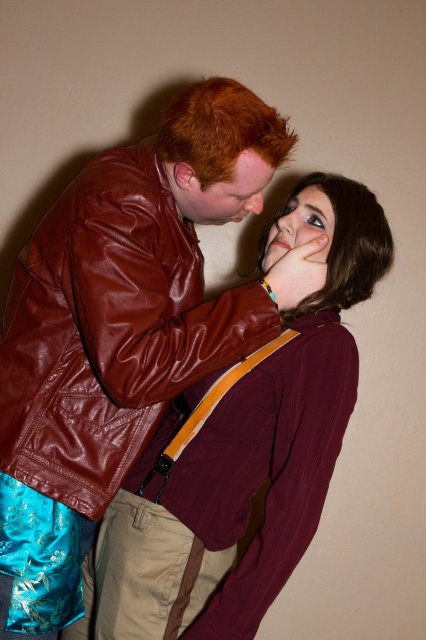
Does point (245, 355) lie in front of point (166, 134)?

No, it is not.

Does shiny brown leather jacket at upper left appear on the left side of smooth brown hair at upper center?

Yes, shiny brown leather jacket at upper left is to the left of smooth brown hair at upper center.

The width and height of the screenshot is (426, 640). What do you see at coordinates (109, 330) in the screenshot?
I see `shiny brown leather jacket at upper left` at bounding box center [109, 330].

The image size is (426, 640). I want to click on shiny brown leather jacket at upper left, so click(109, 330).